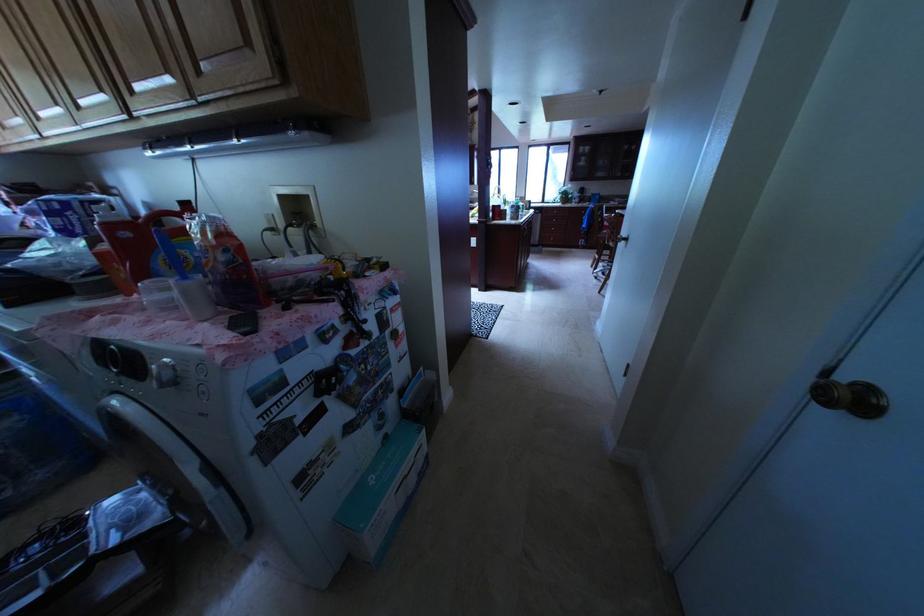
Where would you turn the silver control dial? Please return your answer as a coordinate pair (x, y).

(164, 374)